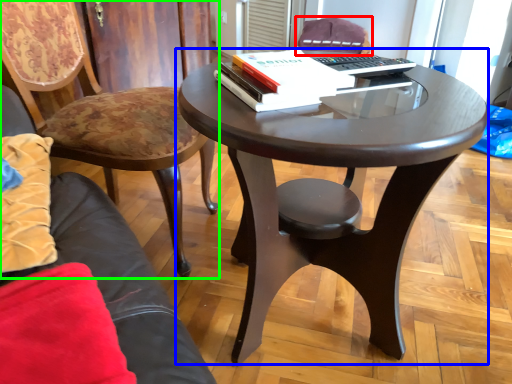
Question: Which is farther away from chair (highlighted by a red box)? coffee table (highlighted by a blue box) or chair (highlighted by a green box)?

Choices:
 (A) coffee table
 (B) chair

Answer: (A)